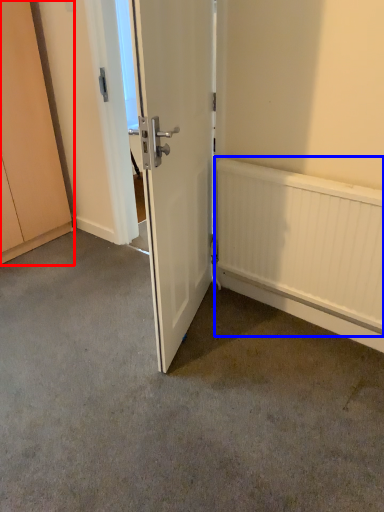
Question: Which point is further to the camera, cabinetry (highlighted by a red box) or radiator (highlighted by a blue box)?

Choices:
 (A) cabinetry
 (B) radiator

Answer: (A)